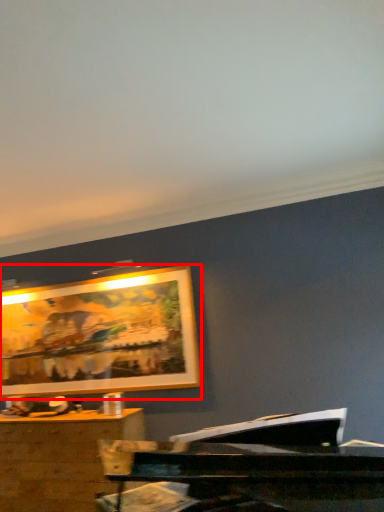
Question: Considering the relative positions of picture frame (annotated by the red box) and desk in the image provided, where is picture frame (annotated by the red box) located with respect to the staircase?

Choices:
 (A) left
 (B) right

Answer: (B)